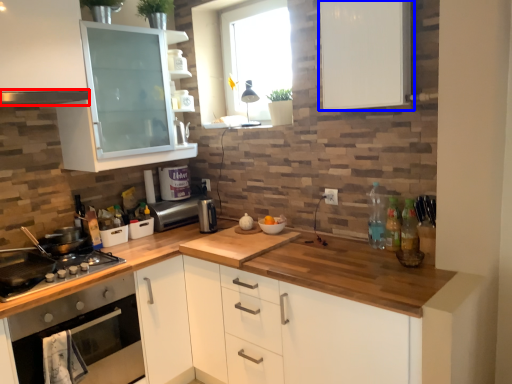
Question: Among these objects, which one is nearest to the camera, exhaust hood (highlighted by a red box) or cabinetry (highlighted by a blue box)?

Choices:
 (A) exhaust hood
 (B) cabinetry

Answer: (B)